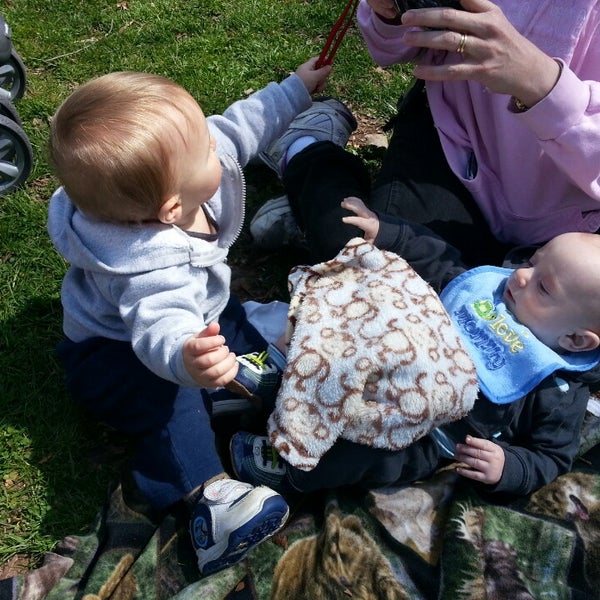
This screenshot has width=600, height=600. I want to click on blanket, so point(344,548), point(353,384).